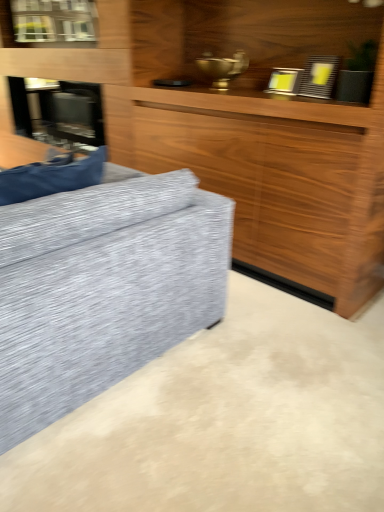
Question: From the image's perspective, is stainless steel fireplace at left on clear glass window at upper left?

Choices:
 (A) yes
 (B) no

Answer: (B)

Question: Considering the relative sizes of stainless steel fireplace at left and clear glass window at upper left in the image provided, is stainless steel fireplace at left bigger than clear glass window at upper left?

Choices:
 (A) no
 (B) yes

Answer: (B)

Question: From a real-world perspective, does stainless steel fireplace at left stand above clear glass window at upper left?

Choices:
 (A) yes
 (B) no

Answer: (B)

Question: Is stainless steel fireplace at left outside clear glass window at upper left?

Choices:
 (A) no
 (B) yes

Answer: (B)

Question: Considering the relative sizes of stainless steel fireplace at left and clear glass window at upper left in the image provided, is stainless steel fireplace at left taller than clear glass window at upper left?

Choices:
 (A) no
 (B) yes

Answer: (B)

Question: Considering the positions of clear glass window at upper left and wooden cabinet at center in the image, is clear glass window at upper left wider or thinner than wooden cabinet at center?

Choices:
 (A) thin
 (B) wide

Answer: (A)

Question: Considering their positions, is clear glass window at upper left located in front of or behind wooden cabinet at center?

Choices:
 (A) behind
 (B) front

Answer: (A)

Question: From the image's perspective, relative to wooden cabinet at center, is clear glass window at upper left above or below?

Choices:
 (A) below
 (B) above

Answer: (B)

Question: Is clear glass window at upper left spatially inside wooden cabinet at center, or outside of it?

Choices:
 (A) inside
 (B) outside

Answer: (A)

Question: Looking at the image, does clear glass window at upper left seem bigger or smaller compared to stainless steel fireplace at left?

Choices:
 (A) big
 (B) small

Answer: (B)

Question: Which is correct: clear glass window at upper left is inside stainless steel fireplace at left, or outside of it?

Choices:
 (A) inside
 (B) outside

Answer: (B)

Question: Considering their positions, is clear glass window at upper left located in front of or behind stainless steel fireplace at left?

Choices:
 (A) front
 (B) behind

Answer: (A)

Question: Is point (31, 29) closer or farther from the camera than point (16, 89)?

Choices:
 (A) farther
 (B) closer

Answer: (B)

Question: Is wooden cabinet at center bigger or smaller than clear glass window at upper left?

Choices:
 (A) big
 (B) small

Answer: (A)

Question: Based on their positions, is wooden cabinet at center located to the left or right of clear glass window at upper left?

Choices:
 (A) left
 (B) right

Answer: (B)